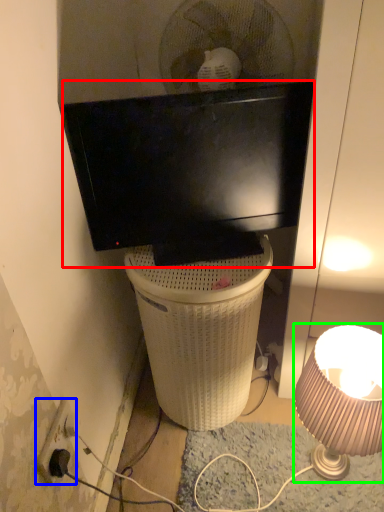
Question: Considering the real-world distances, which object is farthest from television (highlighted by a red box)? power outlet (highlighted by a blue box) or lamp (highlighted by a green box)?

Choices:
 (A) power outlet
 (B) lamp

Answer: (A)